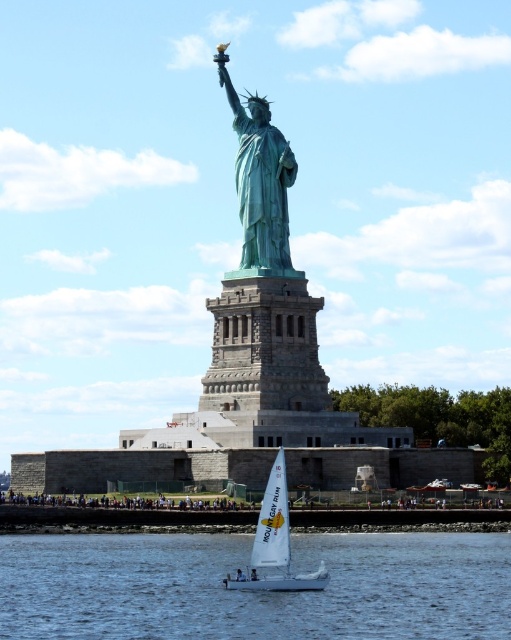
Can you confirm if green patina statue at center is smaller than white sailboat at lower center?

Indeed, green patina statue at center has a smaller size compared to white sailboat at lower center.

Can you confirm if green patina statue at center is wider than white sailboat at lower center?

Yes.

Which is in front, point (248, 237) or point (239, 577)?

Point (239, 577) is more forward.

Find the location of a particular element. This screenshot has width=511, height=640. green patina statue at center is located at coordinates (260, 179).

Does clear blue water at lower center have a lesser height compared to white sailboat at lower center?

Yes, clear blue water at lower center is shorter than white sailboat at lower center.

Is point (300, 544) positioned behind point (258, 518)?

No, (300, 544) is closer to viewer.

This screenshot has height=640, width=511. In order to click on clear blue water at lower center in this screenshot , I will do `click(256, 593)`.

How distant is clear blue water at lower center from green patina statue at center?

A distance of 40.75 meters exists between clear blue water at lower center and green patina statue at center.

Does clear blue water at lower center appear under green patina statue at center?

Indeed, clear blue water at lower center is positioned under green patina statue at center.

Is point (332, 532) positioned in front of point (283, 168)?

Yes, it is.

This screenshot has width=511, height=640. Identify the location of clear blue water at lower center. (256, 593).